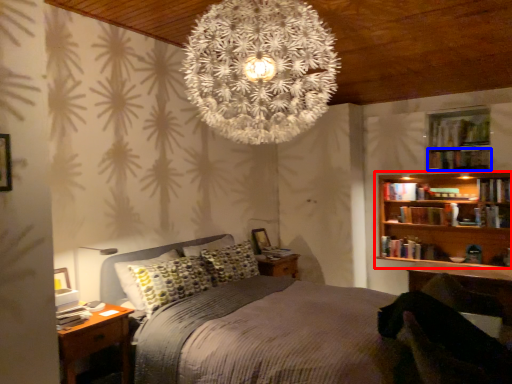
Question: Which point is closer to the camera, bookcase (highlighted by a red box) or book (highlighted by a blue box)?

Choices:
 (A) bookcase
 (B) book

Answer: (B)